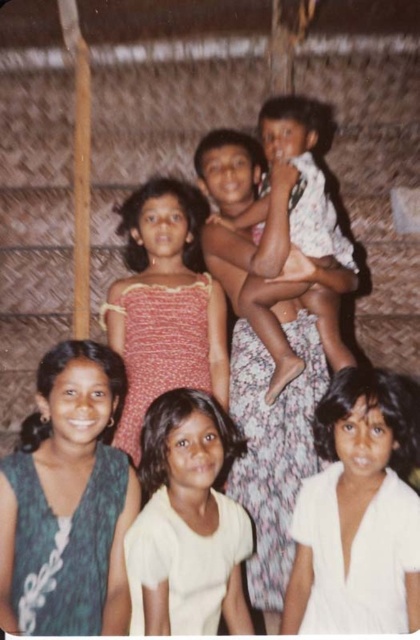
Can you confirm if floral fabric baby at center is thinner than floral fabric dress at center?

In fact, floral fabric baby at center might be wider than floral fabric dress at center.

Is floral fabric baby at center to the left of floral fabric dress at center from the viewer's perspective?

No, floral fabric baby at center is not to the left of floral fabric dress at center.

What are the coordinates of `floral fabric baby at center` in the screenshot? It's located at (293, 240).

From the picture: Can you confirm if green textured dress at lower left is taller than matte pink dress at center?

Yes, green textured dress at lower left is taller than matte pink dress at center.

Does green textured dress at lower left appear on the left side of matte pink dress at center?

Correct, you'll find green textured dress at lower left to the left of matte pink dress at center.

Who is more forward, (46, 483) or (170, 340)?

Point (46, 483) is more forward.

In order to click on green textured dress at lower left in this screenshot , I will do `click(68, 500)`.

Describe the element at coordinates (357, 515) in the screenshot. I see `white matte dress at lower right` at that location.

Who is shorter, white matte dress at lower right or floral fabric baby at center?

white matte dress at lower right is shorter.

Which is behind, point (302, 486) or point (246, 224)?

The point (246, 224) is behind.

Identify the location of white matte dress at lower right. (357, 515).